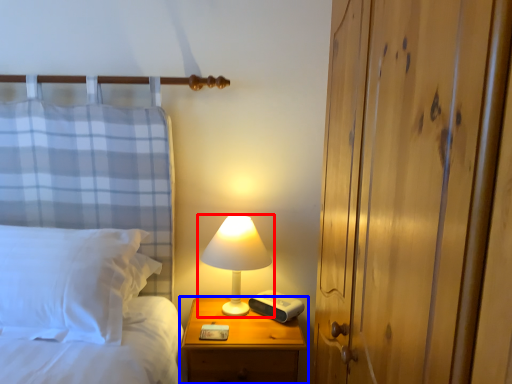
Question: Which of the following is the farthest to the observer, lamp (highlighted by a red box) or nightstand (highlighted by a blue box)?

Choices:
 (A) lamp
 (B) nightstand

Answer: (A)